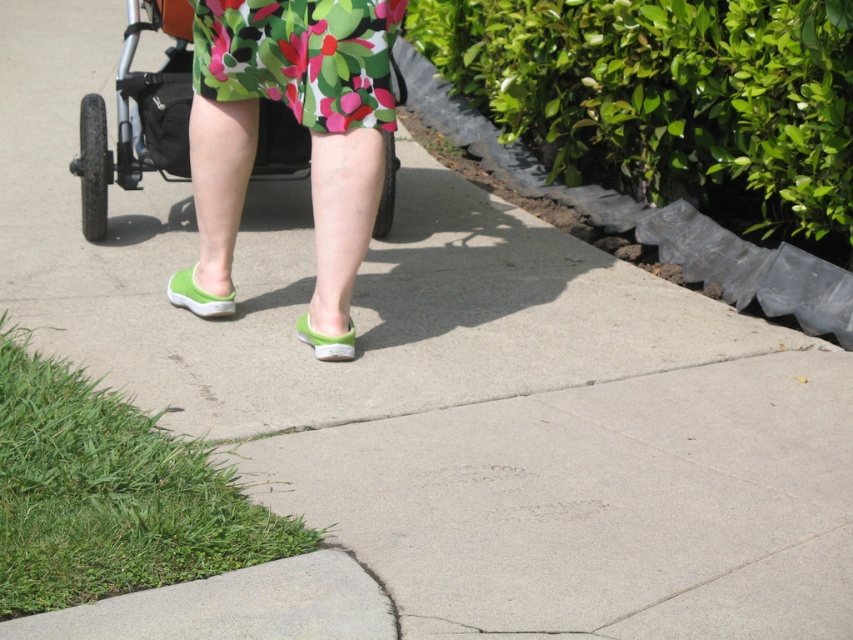
Question: Which of the following is the closest to the observer?

Choices:
 (A) coord(216,51)
 (B) coord(296,81)
 (C) coord(339,355)
 (D) coord(186,304)

Answer: (C)

Question: Does green rubber slipper at center appear on the left side of floral fabric dress at center?

Choices:
 (A) no
 (B) yes

Answer: (B)

Question: Which object is the closest to the green rubber shoe at center?

Choices:
 (A) green rubber slipper at lower center
 (B) floral fabric dress at center
 (C) green rubber slipper at center

Answer: (A)

Question: Which point is farther to the camera?

Choices:
 (A) (349, 326)
 (B) (229, 157)
 (C) (198, 289)
 (D) (277, 0)

Answer: (C)

Question: From the image, what is the correct spatial relationship of floral fabric dress at center in relation to green rubber slipper at lower center?

Choices:
 (A) above
 (B) below

Answer: (A)

Question: Is green rubber slipper at lower center below green rubber shoe at center?

Choices:
 (A) no
 (B) yes

Answer: (A)